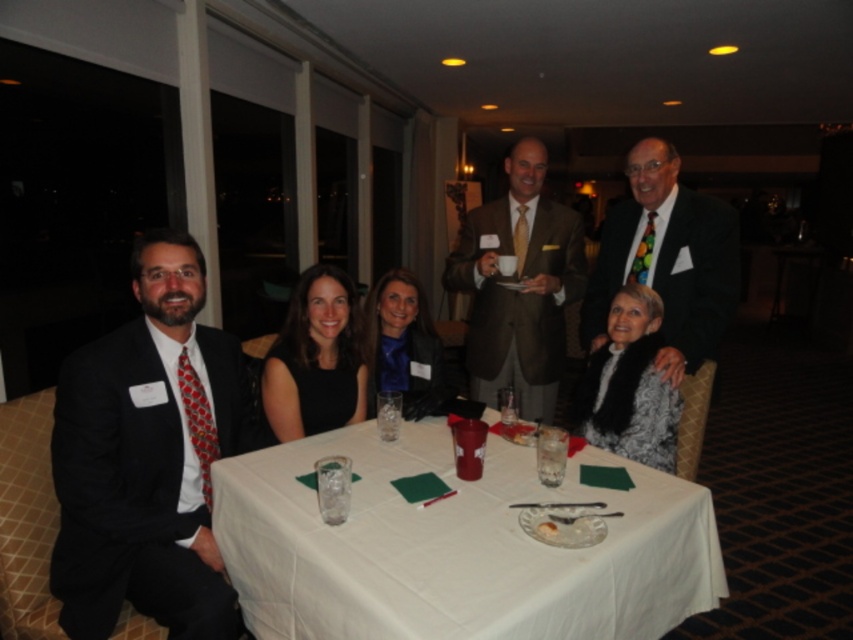
Which is more to the right, white cloth at center or white textured sweater at center?

Positioned to the right is white textured sweater at center.

Which is behind, point (479, 525) or point (631, 321)?

Point (631, 321)

Which is behind, point (502, 484) or point (645, 371)?

The point (645, 371) is more distant.

Locate an element on the screen. white cloth at center is located at coordinates (456, 547).

Is white cloth at center above multicolored tie at upper right?

No.

Who is more forward, (553,632) or (672,264)?

Positioned in front is point (553,632).

The width and height of the screenshot is (853, 640). What are the coordinates of `white cloth at center` in the screenshot? It's located at (456, 547).

Does black fabric dress at center have a lesser width compared to white textured sweater at center?

No, black fabric dress at center is not thinner than white textured sweater at center.

Is black fabric dress at center bigger than white textured sweater at center?

No, black fabric dress at center is not bigger than white textured sweater at center.

Identify the location of black fabric dress at center. The width and height of the screenshot is (853, 640). (316, 358).